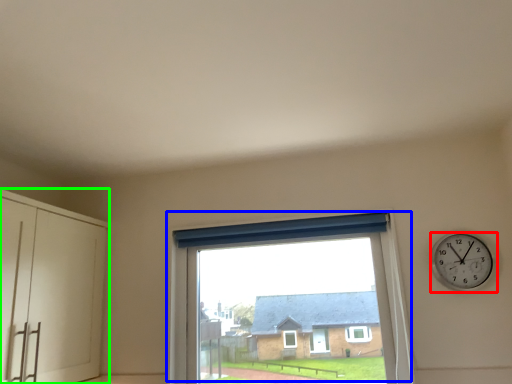
Question: Based on their relative distances, which object is farther from wall clock (highlighted by a red box)? Choose from window (highlighted by a blue box) and dresser (highlighted by a green box).

Choices:
 (A) window
 (B) dresser

Answer: (B)